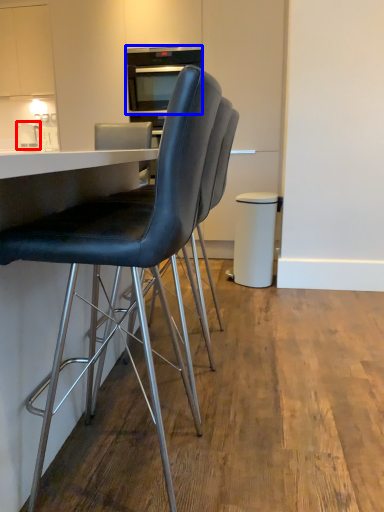
Question: Which object is closer to the camera taking this photo, appliance (highlighted by a red box) or appliance (highlighted by a blue box)?

Choices:
 (A) appliance
 (B) appliance

Answer: (B)